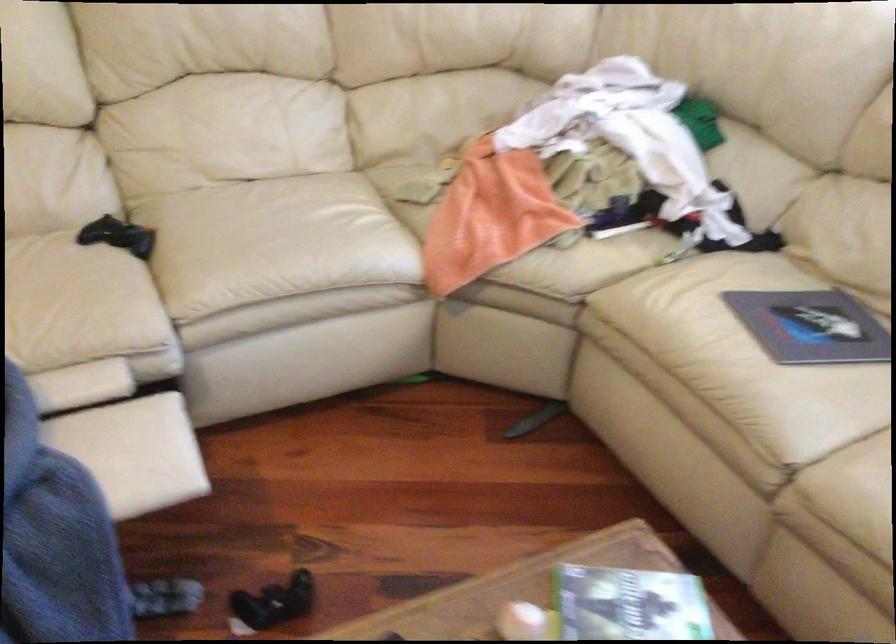
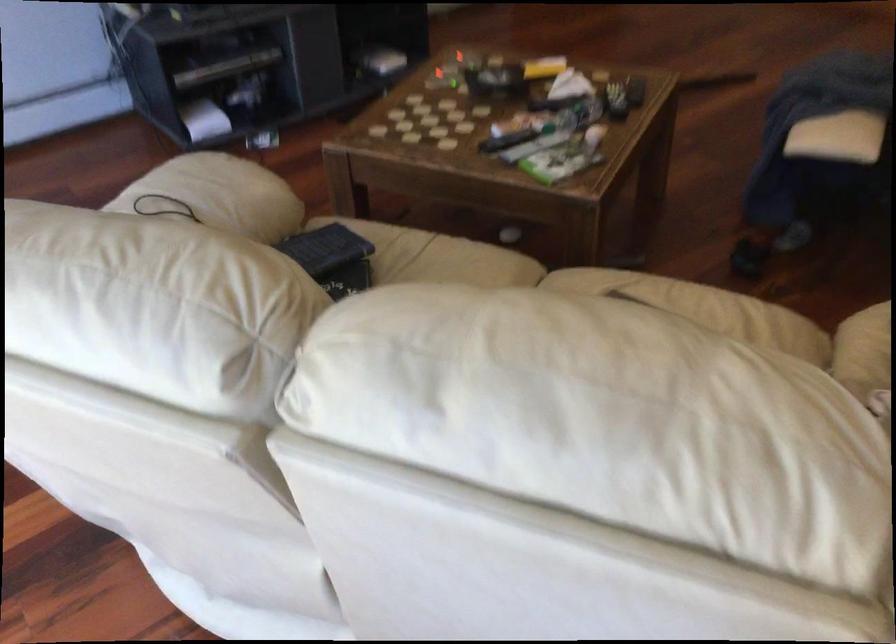
Find the pixel in the second image that matches (x=814, y=375) in the first image.

(584, 285)